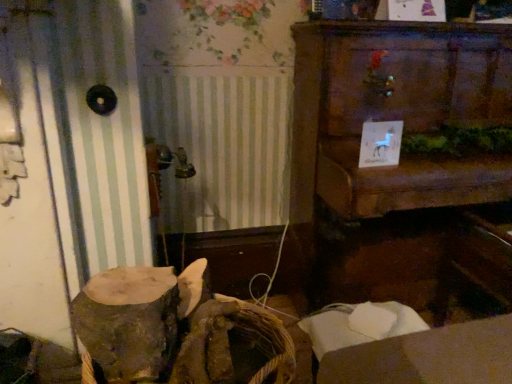
This screenshot has height=384, width=512. I want to click on wooden cabinet at center, so click(x=397, y=113).

What do you see at coordinates (397, 113) in the screenshot? Image resolution: width=512 pixels, height=384 pixels. I see `wooden cabinet at center` at bounding box center [397, 113].

In order to click on wooden cabinet at center in this screenshot , I will do pos(397,113).